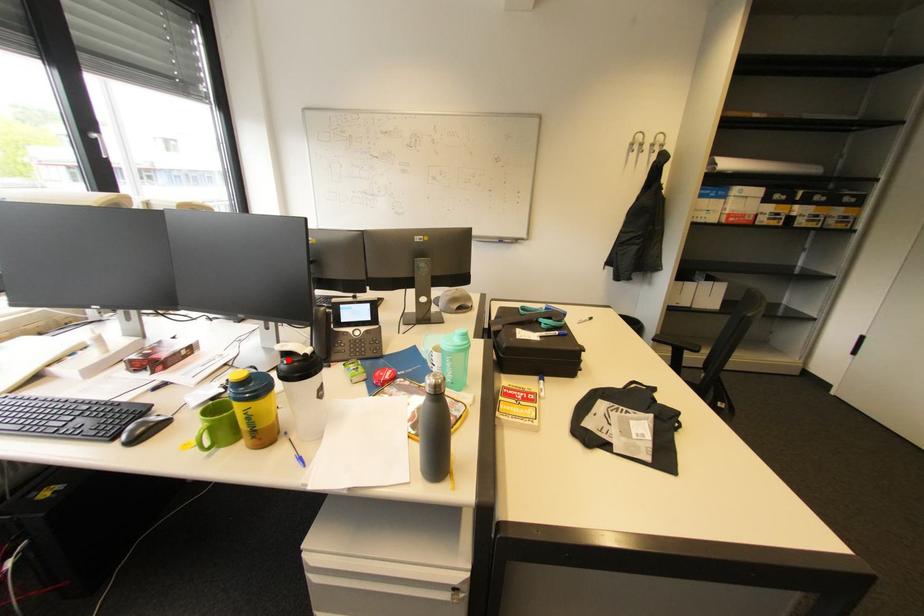
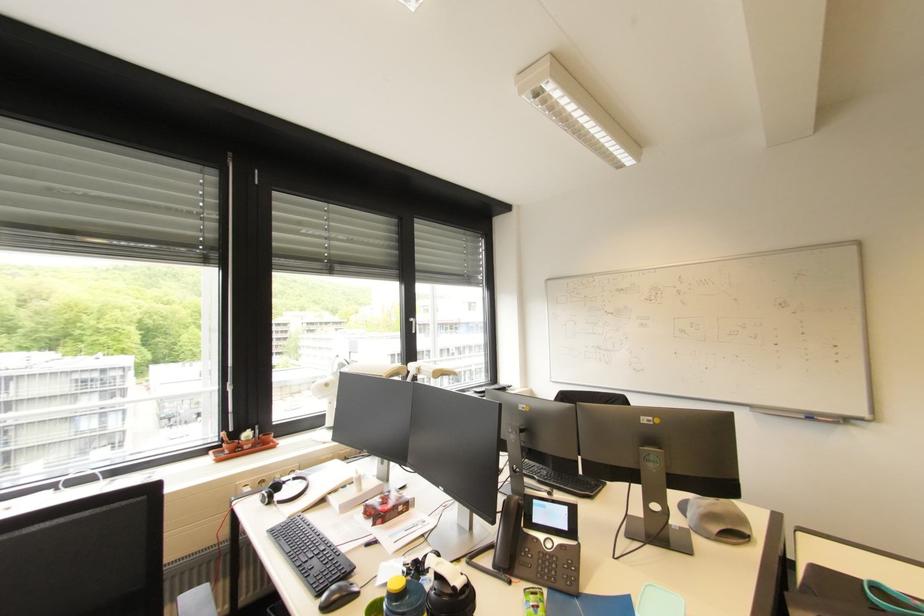
In the second image, find the point that corresponds to the highlighted location in the first image.

(441, 583)